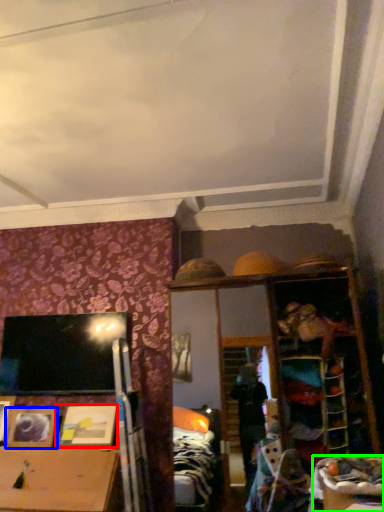
Question: Estimate the real-world distances between objects in this image. Which object is closer to picture frame (highlighted by a red box), picture frame (highlighted by a blue box) or table (highlighted by a green box)?

Choices:
 (A) picture frame
 (B) table

Answer: (A)